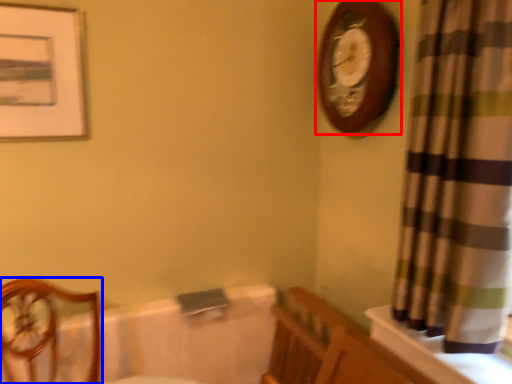
Question: Which object appears farthest to the camera in this image, wall clock (highlighted by a red box) or furniture (highlighted by a blue box)?

Choices:
 (A) wall clock
 (B) furniture

Answer: (A)